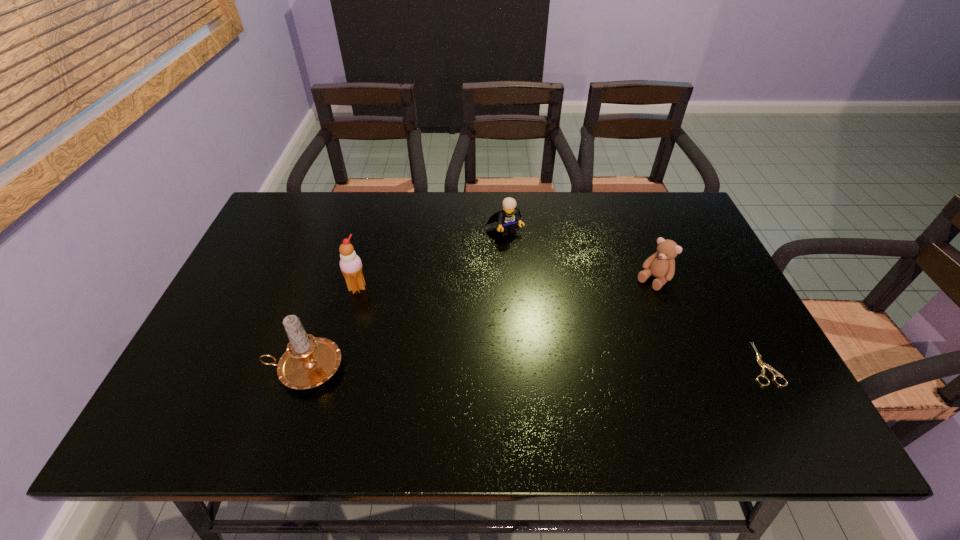
The width and height of the screenshot is (960, 540). In order to click on candle in this screenshot , I will do `click(309, 361)`.

Where is `shears`? Image resolution: width=960 pixels, height=540 pixels. shears is located at coordinates (760, 362).

Find the location of a particular element. the shortest object is located at coordinates (760, 362).

You are a GUI agent. You are given a task and a screenshot of the screen. Output one action in this format:
    pyautogui.click(x=<x>, y=<y>)
    Task: Click on the icecream
    
    Given the screenshot: What is the action you would take?
    pyautogui.click(x=351, y=266)

Where is `teddy bear`? teddy bear is located at coordinates (661, 265).

The height and width of the screenshot is (540, 960). I want to click on Lego, so click(507, 219).

In order to click on the third object from right to left in this screenshot , I will do click(507, 219).

Where is `vacant area situated 0.400m on the right of the candle`? The image size is (960, 540). vacant area situated 0.400m on the right of the candle is located at coordinates (519, 368).

The image size is (960, 540). I want to click on vacant space located on the back of the shortest object, so click(x=701, y=248).

Locate an element on the screen. vacant area located at the front with a straw on the icecream is located at coordinates (444, 346).